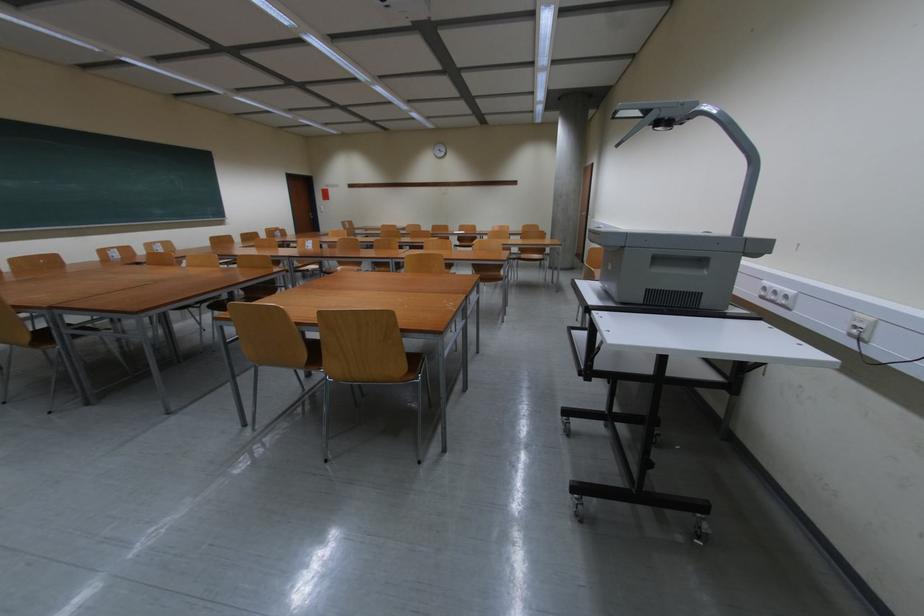
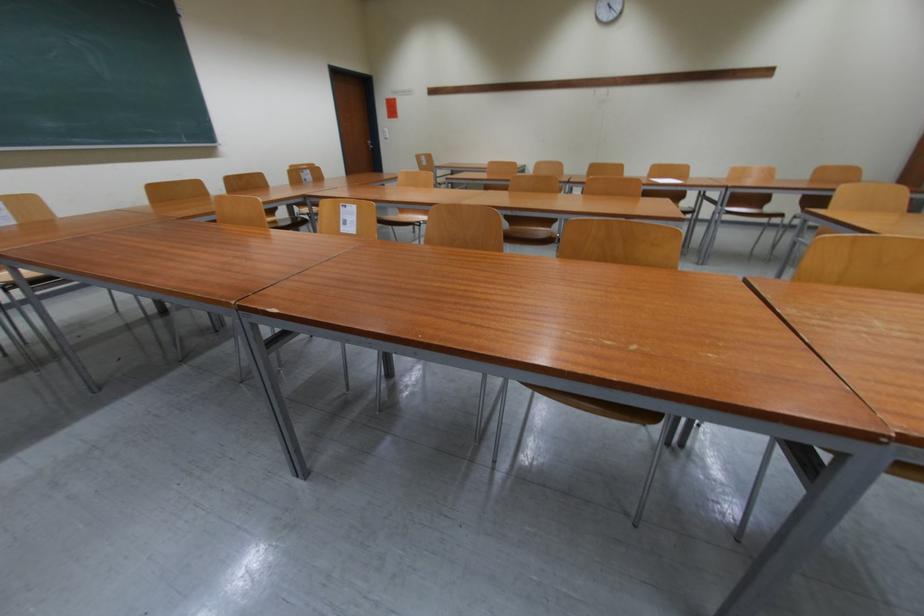
The images are taken continuously from a first-person perspective. In which direction are you moving?

The movement direction of the cameraman is left, forward.